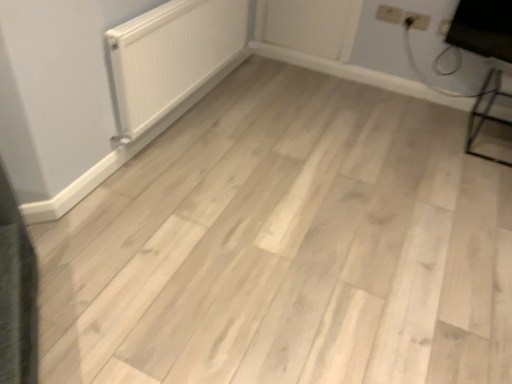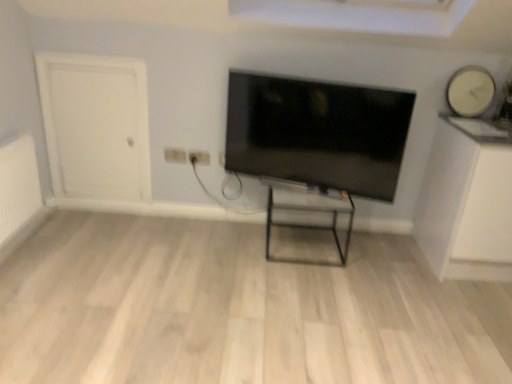
Question: How did the camera likely rotate when shooting the video?

Choices:
 (A) rotated left
 (B) rotated right

Answer: (B)